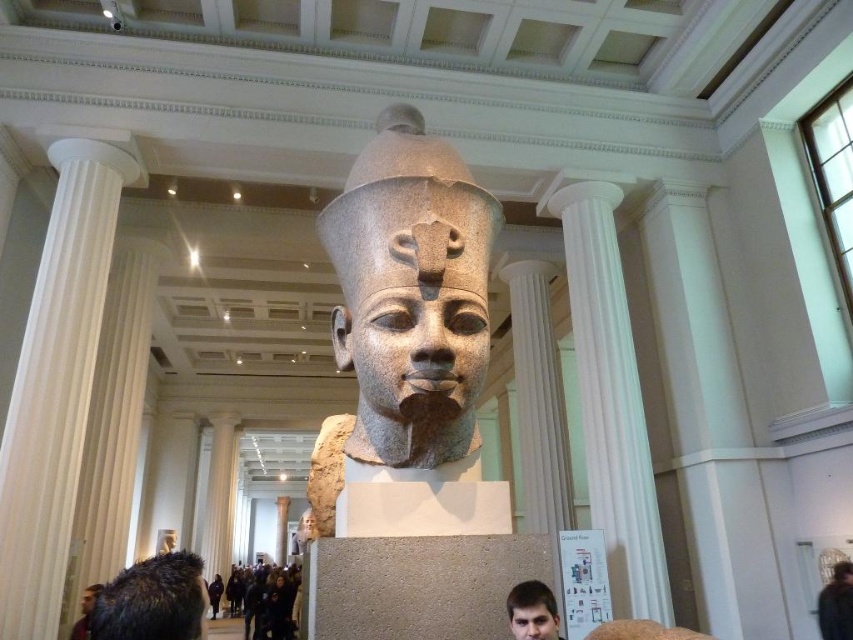
Is point (323, 515) in front of point (543, 593)?

No, (323, 515) is behind (543, 593).

Does gray stone head at center have a lesser width compared to matte gray stone head at center?

Incorrect, gray stone head at center's width is not less than matte gray stone head at center's.

Is point (421, 193) positioned behind point (543, 621)?

Yes.

The image size is (853, 640). Find the location of `gray stone head at center`. gray stone head at center is located at coordinates (405, 310).

I want to click on white marble column at left, so click(x=55, y=385).

Does white marble column at left have a greater width compared to black fuzzy head at lower left?

Yes, white marble column at left is wider than black fuzzy head at lower left.

Find the location of a particular element. The height and width of the screenshot is (640, 853). white marble column at left is located at coordinates (55, 385).

I want to click on white marble column at left, so click(x=55, y=385).

Does black fuzzy head at lower left appear on the left side of matte gray stone head at center?

Indeed, black fuzzy head at lower left is positioned on the left side of matte gray stone head at center.

Identify the location of black fuzzy head at lower left. This screenshot has height=640, width=853. (154, 600).